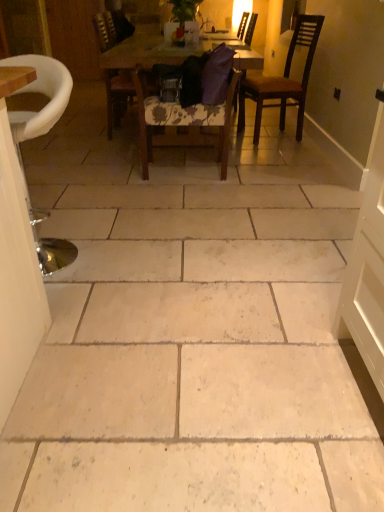
Question: Is floral fabric chair at center, the 2th chair viewed from the front, to the left of wooden door at left from the viewer's perspective?

Choices:
 (A) no
 (B) yes

Answer: (A)

Question: Can you confirm if floral fabric chair at center, the 2th chair viewed from the front, is taller than wooden door at left?

Choices:
 (A) yes
 (B) no

Answer: (B)

Question: Is floral fabric chair at center, the 2th chair viewed from the front, placed right next to wooden door at left?

Choices:
 (A) yes
 (B) no

Answer: (B)

Question: Does floral fabric chair at center, which is counted as the fourth chair, starting from the back, have a greater width compared to wooden door at left?

Choices:
 (A) no
 (B) yes

Answer: (B)

Question: Is floral fabric chair at center, the 2th chair viewed from the front, looking in the opposite direction of wooden door at left?

Choices:
 (A) yes
 (B) no

Answer: (B)

Question: Based on their positions, is purple fabric chair at center, placed as the first chair when sorted from back to front, located to the left or right of floral fabric chair at center, which is counted as the fourth chair, starting from the back?

Choices:
 (A) right
 (B) left

Answer: (A)

Question: Is purple fabric chair at center, which appears as the 5th chair when viewed from the front, bigger or smaller than floral fabric chair at center, the 2th chair viewed from the front?

Choices:
 (A) small
 (B) big

Answer: (B)

Question: From a real-world perspective, is purple fabric chair at center, placed as the first chair when sorted from back to front, physically located above or below floral fabric chair at center, the 2th chair viewed from the front?

Choices:
 (A) below
 (B) above

Answer: (B)

Question: Considering their positions, is purple fabric chair at center, which appears as the 5th chair when viewed from the front, located in front of or behind floral fabric chair at center, the 2th chair viewed from the front?

Choices:
 (A) behind
 (B) front

Answer: (A)

Question: From a real-world perspective, is dark brown wooden chair at upper right, the 3th chair viewed from the back, above or below purple fabric chair at center, which appears as the 5th chair when viewed from the front?

Choices:
 (A) below
 (B) above

Answer: (B)

Question: Considering the positions of dark brown wooden chair at upper right, the third chair when ordered from front to back, and purple fabric chair at center, which appears as the 5th chair when viewed from the front, in the image, is dark brown wooden chair at upper right, the third chair when ordered from front to back, taller or shorter than purple fabric chair at center, which appears as the 5th chair when viewed from the front,?

Choices:
 (A) tall
 (B) short

Answer: (B)

Question: Is point (291, 92) closer or farther from the camera than point (236, 88)?

Choices:
 (A) farther
 (B) closer

Answer: (A)

Question: Relative to purple fabric chair at center, placed as the first chair when sorted from back to front, is dark brown wooden chair at upper right, the 3th chair viewed from the back, in front or behind?

Choices:
 (A) behind
 (B) front

Answer: (B)

Question: Considering the relative positions of wooden door at left and metallic silver stool at left, which is the 5th chair from back to front, in the image provided, is wooden door at left to the left or to the right of metallic silver stool at left, which is the 5th chair from back to front,?

Choices:
 (A) left
 (B) right

Answer: (A)

Question: From a real-world perspective, is wooden door at left positioned above or below metallic silver stool at left, which is the first chair from front to back?

Choices:
 (A) above
 (B) below

Answer: (A)